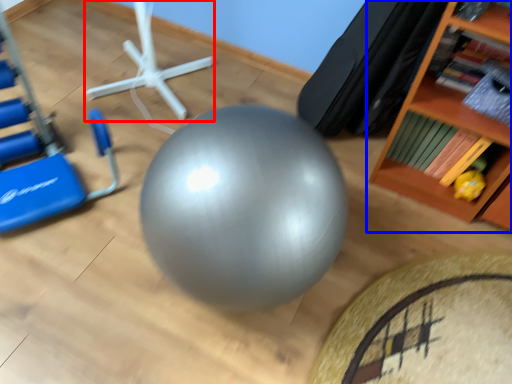
Question: Which object is further to the camera taking this photo, sport equipment (highlighted by a red box) or shelf (highlighted by a blue box)?

Choices:
 (A) sport equipment
 (B) shelf

Answer: (A)